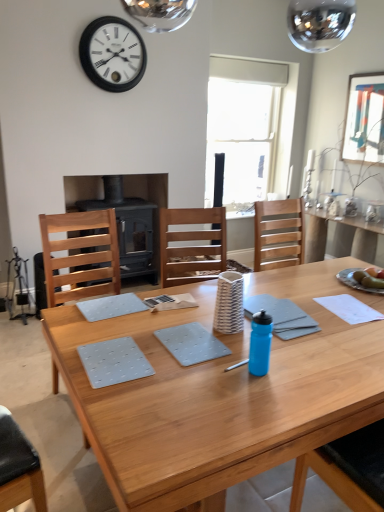
Locate an element on the screen. unoccupied region to the right of blue plastic water bottle at center is located at coordinates (299, 372).